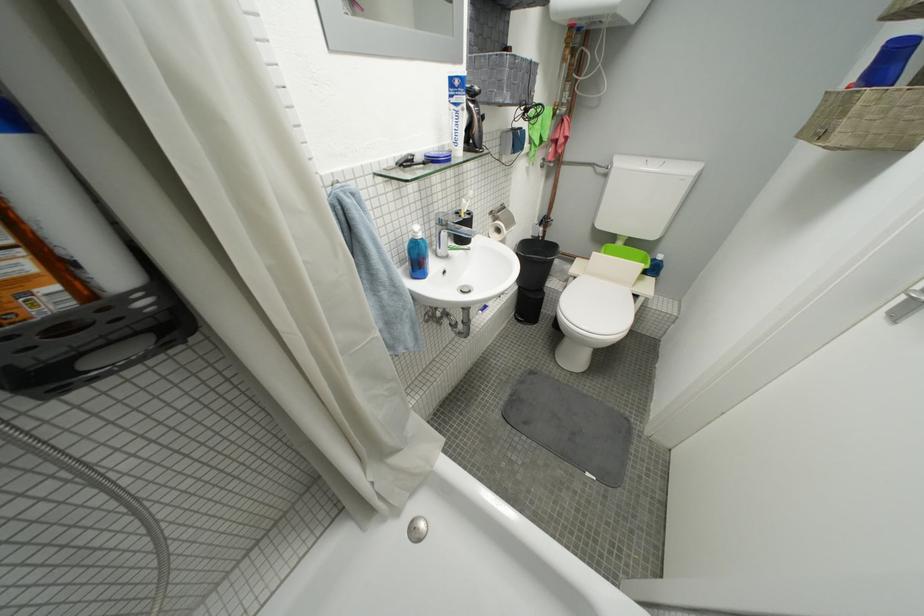
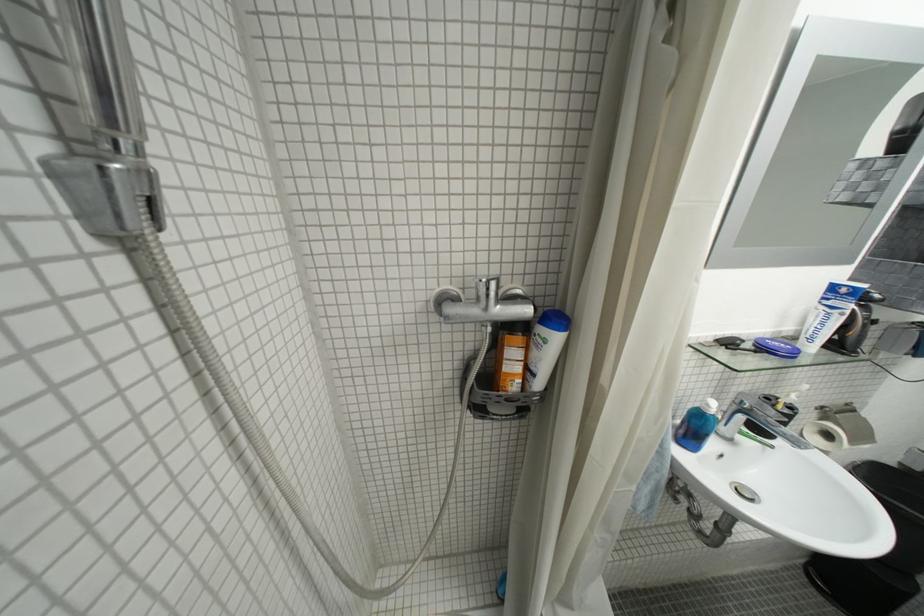
Find the pixel in the second image that matches pixel 453 236 in the first image.

(749, 419)